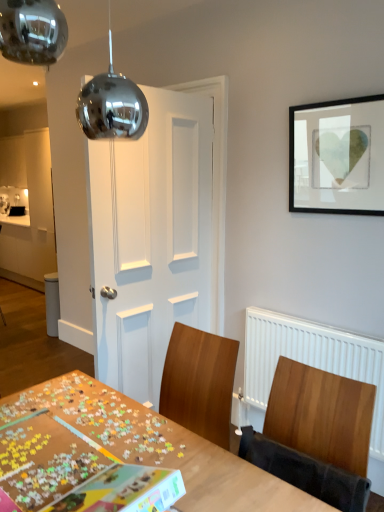
You are a GUI agent. You are given a task and a screenshot of the screen. Output one action in this format:
    pyautogui.click(x=<x>, y=<y>)
    Task: Click on the wooden puzzle board at center
    
    Given the screenshot: What is the action you would take?
    click(x=160, y=446)

Consider the image. Measure the distance between point (300, 455) and camera.

Point (300, 455) is 1.34 meters away from camera.

Find the location of `white matte door at center`. white matte door at center is located at coordinates (153, 239).

Identify the location of wooden puzzle board at center. (160, 446).

Is white matte door at center positioned beyond the bounds of wooden puzzle board at center?

Yes, white matte door at center is not within wooden puzzle board at center.

From the image's perspective, which is above, white matte door at center or wooden puzzle board at center?

white matte door at center.

Is white matte door at center facing towards wooden puzzle board at center?

No, white matte door at center is not facing towards wooden puzzle board at center.

Considering the relative sizes of white matte door at center and wooden puzzle board at center in the image provided, is white matte door at center taller than wooden puzzle board at center?

Indeed, white matte door at center has a greater height compared to wooden puzzle board at center.

Is black matte picture frame at upper right wider or thinner than wooden puzzle board at center?

In the image, black matte picture frame at upper right appears to be more narrow than wooden puzzle board at center.

Is black matte picture frame at upper right positioned in front of wooden puzzle board at center?

No.

Based on the photo, is black matte picture frame at upper right directly adjacent to wooden puzzle board at center?

No, black matte picture frame at upper right is not with wooden puzzle board at center.

Is black matte picture frame at upper right taller or shorter than wooden puzzle board at center?

In the image, black matte picture frame at upper right appears to be shorter than wooden puzzle board at center.

Based on the photo, do you think wooden puzzle board at center is within wooden chair at right, or outside of it?

wooden puzzle board at center is spatially situated outside wooden chair at right.

Which object is closer to the camera taking this photo, wooden puzzle board at center or wooden chair at right?

Positioned in front is wooden puzzle board at center.

Does point (214, 481) come farther from viewer compared to point (300, 470)?

That is False.

Would you consider wooden puzzle board at center to be distant from wooden chair at right?

No, there isn't a large distance between wooden puzzle board at center and wooden chair at right.

How far apart are wooden puzzle board at center and white matte door at center?

wooden puzzle board at center is 36.95 inches from white matte door at center.

Who is shorter, wooden puzzle board at center or white matte door at center?

With less height is wooden puzzle board at center.

From a real-world perspective, is wooden puzzle board at center physically located above or below white matte door at center?

Clearly, from a real-world perspective, wooden puzzle board at center is below white matte door at center.

Does point (97, 408) appear closer or farther from the camera than point (197, 190)?

Point (97, 408) appears to be closer to the viewer than point (197, 190).

Is white matte door at center smaller than wooden chair at right?

No, white matte door at center is not smaller than wooden chair at right.

Is the position of white matte door at center less distant than that of wooden chair at right?

That is False.

Considering the points (104, 351) and (305, 474), which point is in front, point (104, 351) or point (305, 474)?

Point (305, 474)

From the image's perspective, is wooden chair at right above or below white matte door at center?

wooden chair at right is situated lower than white matte door at center in the image.

Is wooden chair at right behind white matte door at center?

No, the depth of wooden chair at right is less than that of white matte door at center.

Considering the sizes of objects wooden chair at right and white matte door at center in the image provided, who is thinner, wooden chair at right or white matte door at center?

wooden chair at right.

Which is farther from the camera, (163, 314) or (314, 134)?

Point (163, 314)

Can you confirm if white matte door at center is smaller than black matte picture frame at upper right?

No, white matte door at center is not smaller than black matte picture frame at upper right.

From the picture: Considering the relative sizes of white matte door at center and black matte picture frame at upper right in the image provided, is white matte door at center shorter than black matte picture frame at upper right?

No, white matte door at center is not shorter than black matte picture frame at upper right.

This screenshot has height=512, width=384. Find the location of `door below the black matte picture frame at upper right (from a real-world perspective)`. door below the black matte picture frame at upper right (from a real-world perspective) is located at coordinates (153, 239).

You are a GUI agent. You are given a task and a screenshot of the screen. Output one action in this format:
    pyautogui.click(x=<x>, y=<y>)
    Task: Click on the door located behind the wooden puzzle board at center
    
    Given the screenshot: What is the action you would take?
    pyautogui.click(x=153, y=239)

Identify the location of picture frame lying above the wooden puzzle board at center (from the image's perspective). (337, 157).

From the image, which object appears to be farther from wooden chair at right, wooden puzzle board at center or white matte door at center?

The object further to wooden chair at right is white matte door at center.

When comparing their distances from black matte picture frame at upper right, does wooden puzzle board at center or white matte door at center seem closer?

white matte door at center is closer to black matte picture frame at upper right.

When comparing their distances from wooden chair at right, does black matte picture frame at upper right or white matte door at center seem further?

Among the two, black matte picture frame at upper right is located further to wooden chair at right.

Estimate the real-world distances between objects in this image. Which object is further from white matte door at center, wooden puzzle board at center or wooden chair at right?

wooden chair at right.

Which object lies nearer to the anchor point wooden chair at right, white matte door at center or black matte picture frame at upper right?

white matte door at center is positioned closer to the anchor wooden chair at right.

Based on their spatial positions, is white matte door at center or wooden chair at right closer to wooden puzzle board at center?

wooden chair at right is closer to wooden puzzle board at center.

Based on their spatial positions, is black matte picture frame at upper right or wooden chair at right further from white matte door at center?

wooden chair at right lies further to white matte door at center than the other object.

When comparing their distances from white matte door at center, does black matte picture frame at upper right or wooden puzzle board at center seem further?

The object further to white matte door at center is wooden puzzle board at center.

Find the location of a particular element. The height and width of the screenshot is (512, 384). door between black matte picture frame at upper right and wooden chair at right in the up-down direction is located at coordinates (153, 239).

Identify the location of chair between wooden puzzle board at center and white matte door at center from front to back. The width and height of the screenshot is (384, 512). (305, 472).

You are a GUI agent. You are given a task and a screenshot of the screen. Output one action in this format:
    pyautogui.click(x=<x>, y=<y>)
    Task: Click on the chair between black matte picture frame at upper right and wooden puzzle board at center from top to bottom
    
    Given the screenshot: What is the action you would take?
    pyautogui.click(x=305, y=472)

Where is `door between black matte picture frame at upper right and wooden puzzle board at center in the vertical direction`? This screenshot has width=384, height=512. door between black matte picture frame at upper right and wooden puzzle board at center in the vertical direction is located at coordinates (153, 239).